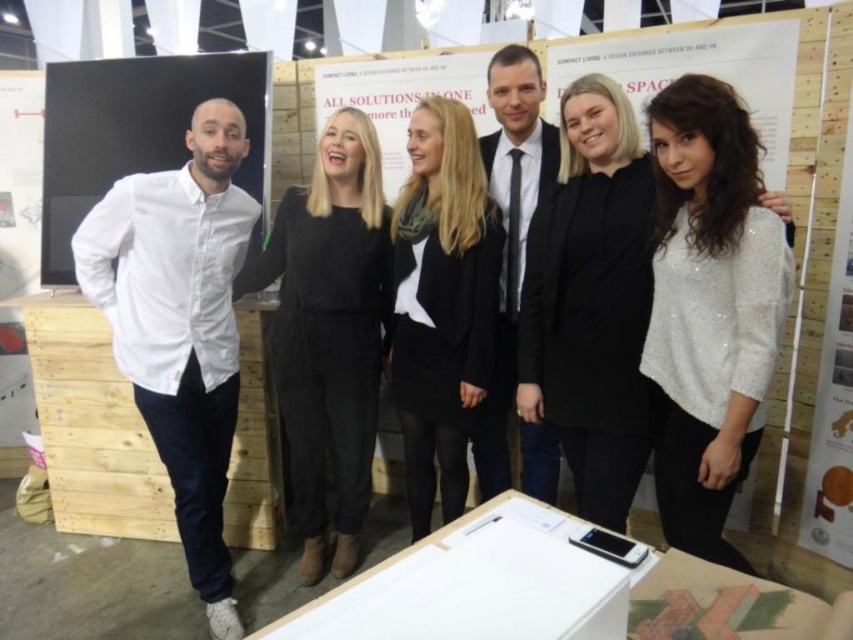
Question: Which object is farther from the camera taking this photo?

Choices:
 (A) black jersey at center
 (B) white sequined sweater at center
 (C) black matte suit at center
 (D) black matte blazer at center

Answer: (C)

Question: Which object appears farthest from the camera in this image?

Choices:
 (A) black jersey at center
 (B) white sequined sweater at center
 (C) white cotton shirt at left
 (D) black matte suit at center

Answer: (D)

Question: Among these points, which one is farthest from the camera?

Choices:
 (A) (498, 253)
 (B) (532, 470)
 (C) (44, 170)
 (D) (531, 362)

Answer: (C)

Question: Does white sequined sweater at center have a smaller size compared to black matte blazer at center?

Choices:
 (A) no
 (B) yes

Answer: (A)

Question: Is black jersey at center wider than black matte suit at center?

Choices:
 (A) yes
 (B) no

Answer: (A)

Question: Does white sequined sweater at center have a greater width compared to black matte blazer at center?

Choices:
 (A) no
 (B) yes

Answer: (A)